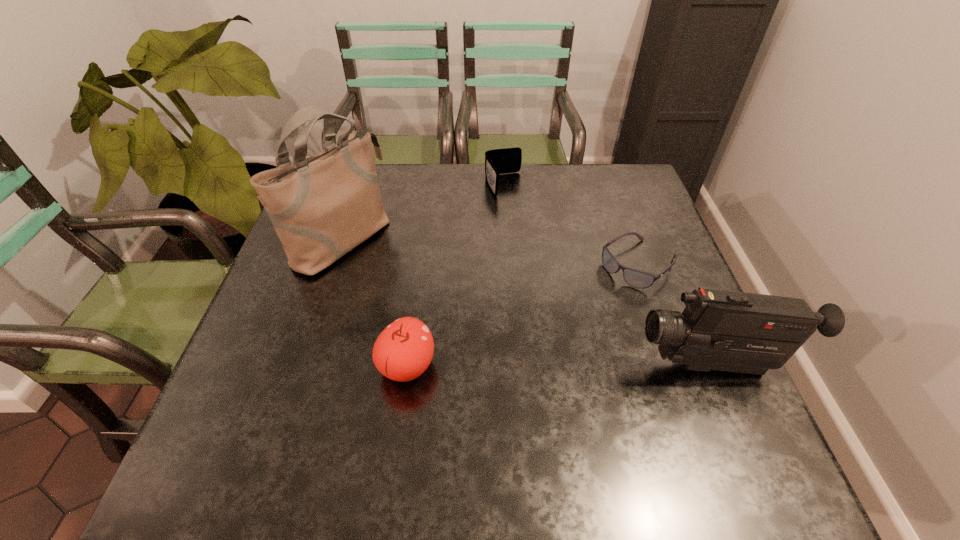
Locate an element on the screen. free spot on the desktop that is between the apple and the camcorder and is positioned on the front-facing side of the shoulder bag is located at coordinates (570, 366).

The width and height of the screenshot is (960, 540). I want to click on free space on the desktop that is between the second object from left to right and the camcorder and is positioned on the outer surface of the fourth tallest object, so click(x=602, y=366).

Locate an element on the screen. free space on the desktop that is between the third shortest object and the second tallest object and is positioned on the lenses of the sunglasses is located at coordinates (518, 366).